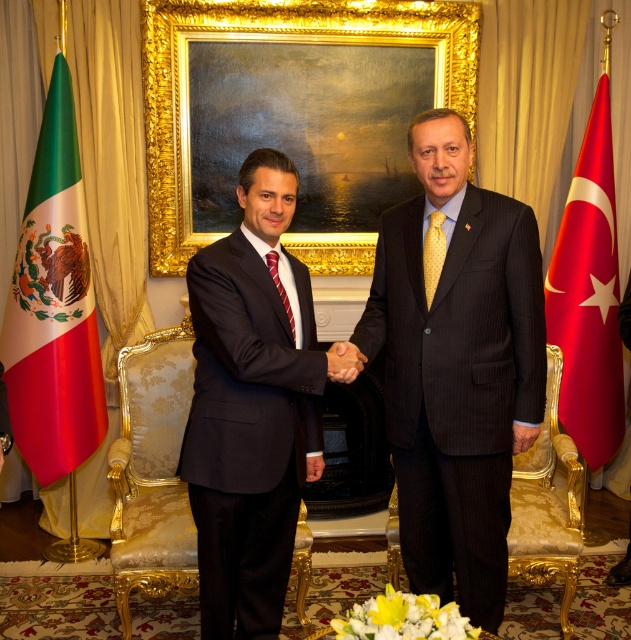
Is goldmaterial/texturepicture frame at upper center wider than red fabric flag at left?

Correct, the width of goldmaterial/texturepicture frame at upper center exceeds that of red fabric flag at left.

Find the location of a particular element. The width and height of the screenshot is (631, 640). goldmaterial/texturepicture frame at upper center is located at coordinates (273, 36).

Identify the location of goldmaterial/texturepicture frame at upper center. (273, 36).

Which is more to the right, goldmaterial/texturepicture frame at upper center or yellow dotted tie at center?

yellow dotted tie at center is more to the right.

Between goldmaterial/texturepicture frame at upper center and yellow dotted tie at center, which one has more height?

Standing taller between the two is goldmaterial/texturepicture frame at upper center.

Is point (401, 4) farther from viewer compared to point (428, 224)?

Yes, it is behind point (428, 224).

Identify the location of goldmaterial/texturepicture frame at upper center. (273, 36).

Looking at this image, can you confirm if dark pinstripe suit at center is positioned below red fabric flag at left?

Yes.

Can you confirm if dark pinstripe suit at center is shorter than red fabric flag at left?

Yes.

Is point (437, 378) behind point (57, 454)?

No.

The image size is (631, 640). I want to click on dark pinstripe suit at center, so click(456, 368).